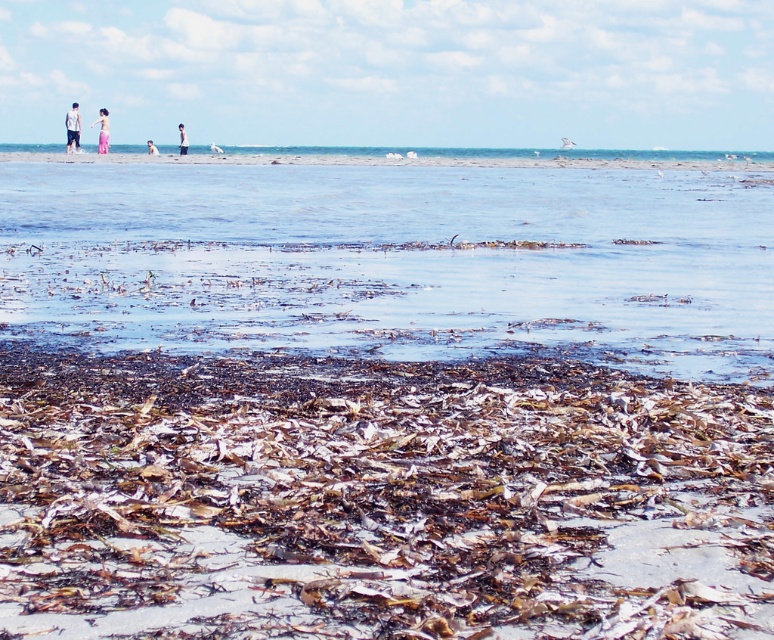
Is pink fabric dress at upper left smaller than pink fabric at upper left?

Yes.

Does pink fabric dress at upper left have a lesser height compared to pink fabric at upper left?

Yes.

Locate an element on the screen. This screenshot has width=774, height=640. pink fabric dress at upper left is located at coordinates tap(101, 131).

Does brown/dry sand at lower center have a lesser width compared to pink fabric dress at upper left?

No.

Between point (461, 486) and point (103, 109), which one is positioned in front?

Point (461, 486) is in front.

Identify the location of brown/dry sand at lower center. (379, 499).

Between point (629, 173) and point (149, 145), which one is positioned in front?

Point (629, 173) is in front.

Is brown/textured seaweed at center positioned at the back of pink fabric at upper left?

No, it is in front of pink fabric at upper left.

The image size is (774, 640). What do you see at coordinates (392, 259) in the screenshot? I see `brown/textured seaweed at center` at bounding box center [392, 259].

Where is `brown/textured seaweed at center`? brown/textured seaweed at center is located at coordinates (392, 259).